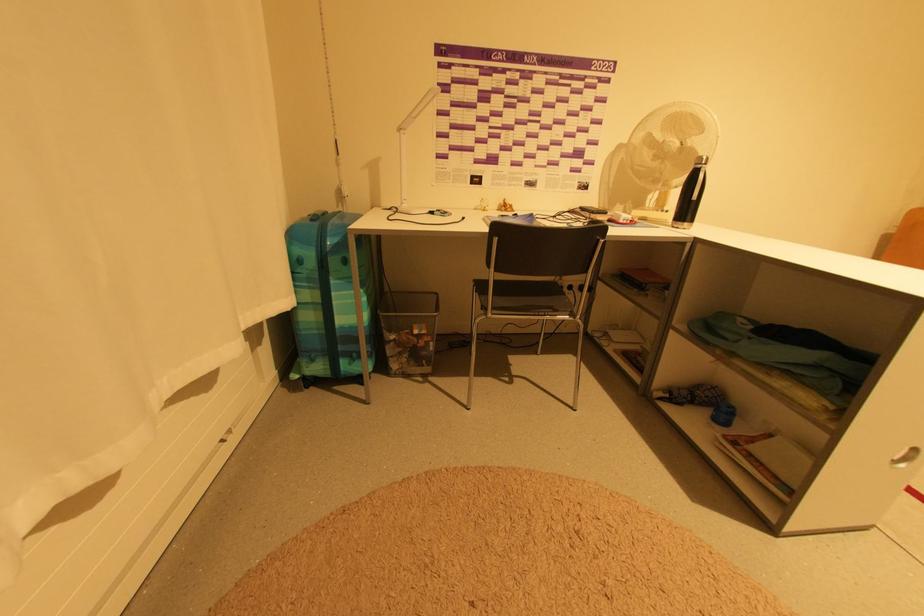
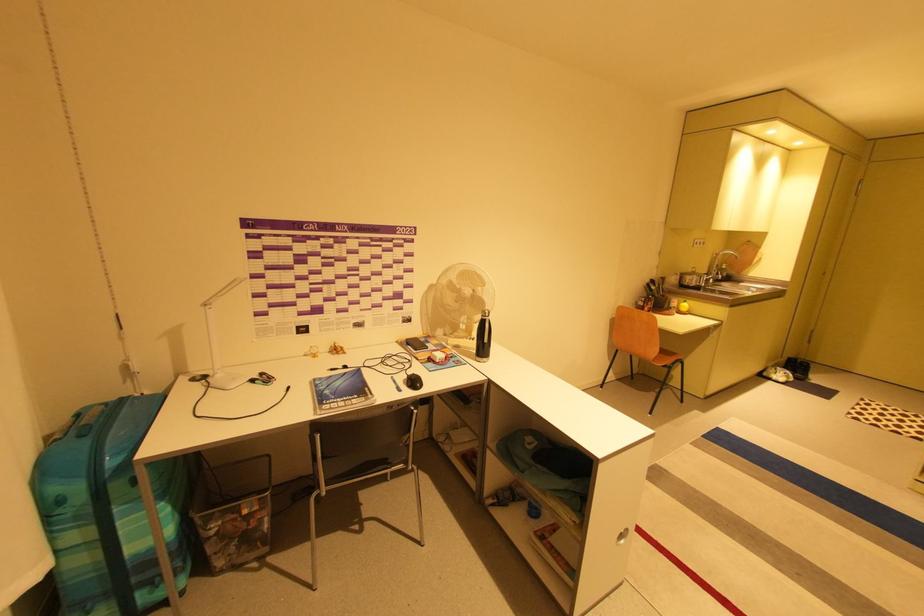
Locate, in the second image, the point that corresponds to pixel 673 211 in the first image.

(479, 339)